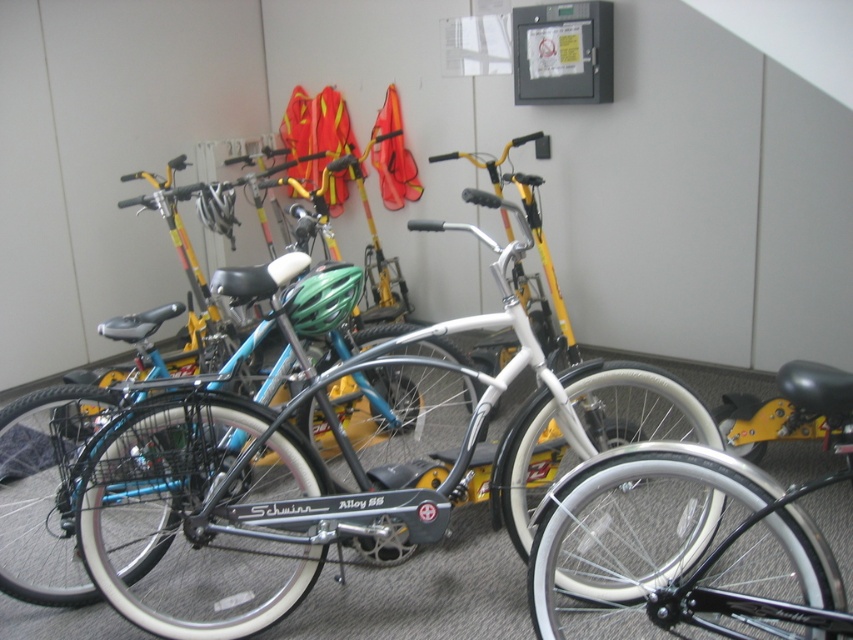
Question: Does shiny silver bicycle at center appear over white rubber bicycle at center?

Choices:
 (A) no
 (B) yes

Answer: (B)

Question: Among these objects, which one is farthest from the camera?

Choices:
 (A) shiny silver bicycle at center
 (B) white rubber bicycle at center

Answer: (A)

Question: Which object is closer to the camera taking this photo?

Choices:
 (A) white rubber bicycle at center
 (B) shiny silver bicycle at center

Answer: (A)

Question: In this image, where is shiny silver bicycle at center located relative to white rubber bicycle at center?

Choices:
 (A) below
 (B) above

Answer: (B)

Question: Does shiny silver bicycle at center lie behind white rubber bicycle at center?

Choices:
 (A) yes
 (B) no

Answer: (A)

Question: Which point is farther from the camera taking this photo?

Choices:
 (A) (264, 490)
 (B) (596, 557)

Answer: (A)